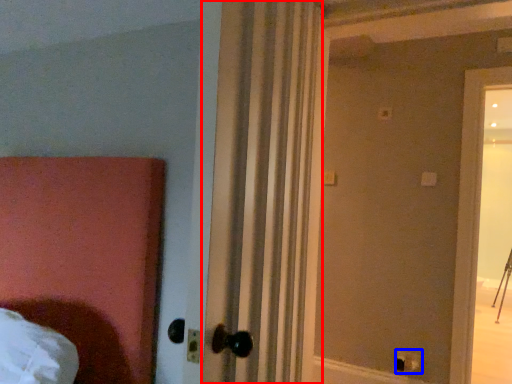
Question: Which of the following is the closest to the observer, curtain (highlighted by a red box) or electric outlet (highlighted by a blue box)?

Choices:
 (A) curtain
 (B) electric outlet

Answer: (A)